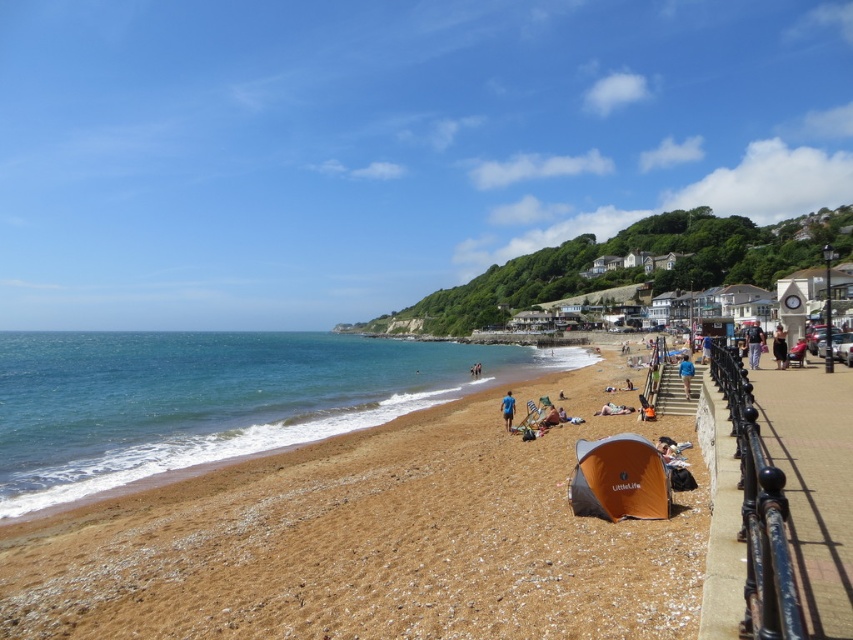
Can you confirm if blue sky at upper center is bigger than brown gravelly sand at center?

Yes.

Which is in front, point (288, 160) or point (341, 595)?

Point (341, 595) is in front.

I want to click on blue sky at upper center, so click(383, 145).

Is beige fabric bag at center above dark brown fabric dress at lower right?

No, beige fabric bag at center is not above dark brown fabric dress at lower right.

Can you confirm if beige fabric bag at center is smaller than dark brown fabric dress at lower right?

Correct, beige fabric bag at center occupies less space than dark brown fabric dress at lower right.

Between point (549, 426) and point (773, 342), which one is positioned in front?

Positioned in front is point (549, 426).

I want to click on beige fabric bag at center, so click(x=544, y=413).

Between dark blue jeans at lower right and blue fabric at center, which one has more height?

Standing taller between the two is dark blue jeans at lower right.

Does dark blue jeans at lower right have a greater height compared to blue fabric at center?

Correct, dark blue jeans at lower right is much taller as blue fabric at center.

Which is behind, point (759, 340) or point (503, 408)?

The point (503, 408) is more distant.

Where is `dark blue jeans at lower right`? Image resolution: width=853 pixels, height=640 pixels. dark blue jeans at lower right is located at coordinates (753, 344).